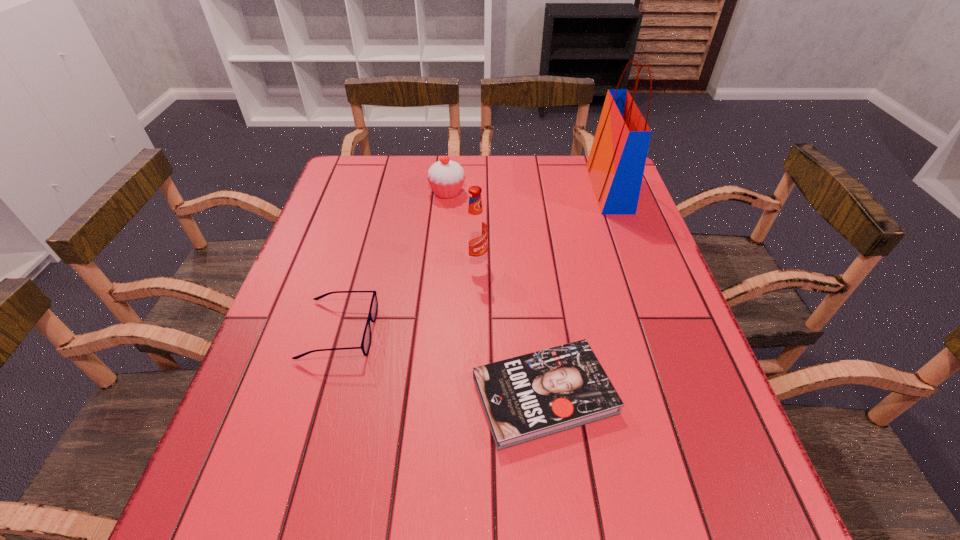
Where is `free spot located 0.270m on the handle side of the tallest object`? free spot located 0.270m on the handle side of the tallest object is located at coordinates (502, 190).

Find the location of a particular element. The width and height of the screenshot is (960, 540). vacant position located on the left of the fourth shortest object is located at coordinates 308,261.

Locate an element on the screen. vacant space located 0.050m on the back of the third tallest object is located at coordinates (449, 173).

Find the location of `free spot located on the front-facing side of the fourth tallest object`. free spot located on the front-facing side of the fourth tallest object is located at coordinates (541, 330).

Image resolution: width=960 pixels, height=540 pixels. What are the coordinates of `vacant space located 0.100m on the back of the shortest object` in the screenshot? It's located at (535, 312).

Image resolution: width=960 pixels, height=540 pixels. I want to click on shopping bag at the far edge, so click(x=616, y=163).

The image size is (960, 540). Find the location of `cupcake at the far edge`. cupcake at the far edge is located at coordinates (446, 177).

Locate an element on the screen. The width and height of the screenshot is (960, 540). object that is positioned at the left edge is located at coordinates (366, 339).

The height and width of the screenshot is (540, 960). I want to click on object positioned at the right edge, so click(616, 163).

At what (x,y) coordinates should I click in order to perform the action: click on object at the far right corner. Please return your answer as a coordinate pair (x, y). Looking at the image, I should click on (616, 163).